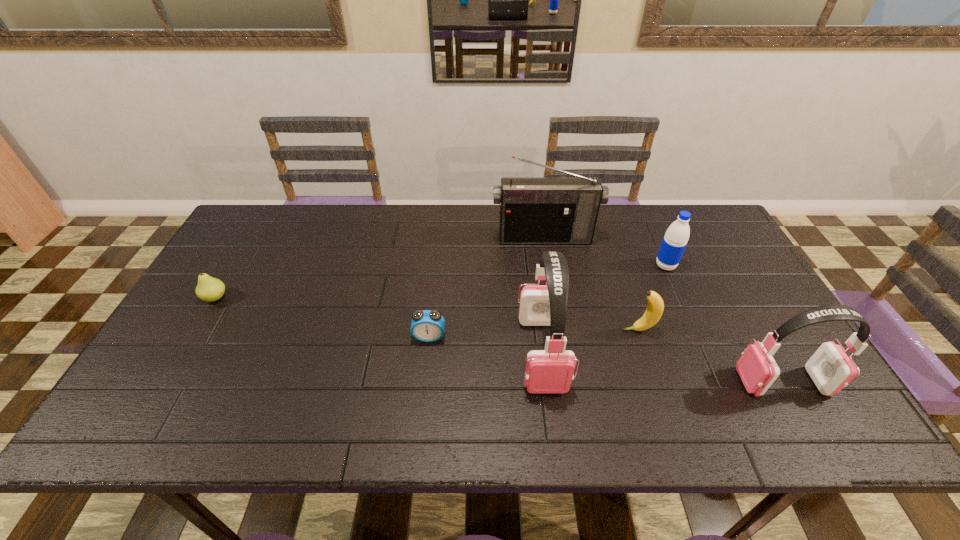
In the current image, all earphones are evenly spaced. To maintain this equal spacing, where should an additional earphone be placed on the left? Please point out a free spot. Please provide its 2D coordinates. Your answer should be formatted as a tuple, i.e. [(x, y)], where the tuple contains the x and y coordinates of a point satisfying the conditions above.

[(326, 327)]